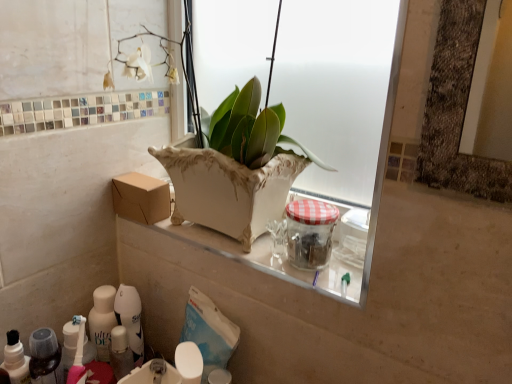
What do you see at coordinates (310, 233) in the screenshot? The width and height of the screenshot is (512, 384). I see `clear glass jar with red checkered lid at center` at bounding box center [310, 233].

What do you see at coordinates (170, 368) in the screenshot? The height and width of the screenshot is (384, 512). I see `white glossy sink at lower center` at bounding box center [170, 368].

Where is `white glossy toothpaste tube at lower left`? white glossy toothpaste tube at lower left is located at coordinates (16, 359).

Is white glossy sink at lower center shorter than white glossy toothpaste tube at lower left?

Indeed, white glossy sink at lower center has a lesser height compared to white glossy toothpaste tube at lower left.

From the image's perspective, is white glossy sink at lower center above or below white glossy toothpaste tube at lower left?

white glossy sink at lower center is situated lower than white glossy toothpaste tube at lower left in the image.

Does white glossy sink at lower center contain white glossy toothpaste tube at lower left?

No, white glossy toothpaste tube at lower left is not a part of white glossy sink at lower center.

In terms of width, does white glossy sink at lower center look wider or thinner when compared to white glossy toothpaste tube at lower left?

Considering their sizes, white glossy sink at lower center looks broader than white glossy toothpaste tube at lower left.

Can you see white glossy toothpaste tube at lower left touching brown cardboard box at center?

white glossy toothpaste tube at lower left is not next to brown cardboard box at center, and they're not touching.

Considering the sizes of objects white glossy toothpaste tube at lower left and brown cardboard box at center in the image provided, who is taller, white glossy toothpaste tube at lower left or brown cardboard box at center?

white glossy toothpaste tube at lower left is taller.

Considering the sizes of objects white glossy toothpaste tube at lower left and brown cardboard box at center in the image provided, who is wider, white glossy toothpaste tube at lower left or brown cardboard box at center?

brown cardboard box at center.

Can you confirm if white glossy sink at lower center is positioned to the left of brown cardboard box at center?

No.

Locate an element on the screen. The height and width of the screenshot is (384, 512). cardboard box on the left of white glossy sink at lower center is located at coordinates (141, 198).

Is white glossy sink at lower center facing away from brown cardboard box at center?

white glossy sink at lower center is not turned away from brown cardboard box at center.

What's the angular difference between white glossy sink at lower center and brown cardboard box at center's facing directions?

The facing directions of white glossy sink at lower center and brown cardboard box at center are 2.61 degrees apart.

Is point (199, 361) farther from camera compared to point (310, 234)?

That is False.

What's the angular difference between white glossy sink at lower center and clear glass jar with red checkered lid at center's facing directions?

There is a 4.91-degree angle between the facing directions of white glossy sink at lower center and clear glass jar with red checkered lid at center.

Is white glossy sink at lower center shorter than clear glass jar with red checkered lid at center?

Yes, white glossy sink at lower center is shorter than clear glass jar with red checkered lid at center.

From a real-world perspective, is white glossy sink at lower center positioned over clear glass jar with red checkered lid at center based on gravity?

No.

Which object is thinner, brown cardboard box at center or clear glass jar with red checkered lid at center?

clear glass jar with red checkered lid at center is thinner.

Looking at this image, would you say brown cardboard box at center is inside or outside clear glass jar with red checkered lid at center?

brown cardboard box at center is located beyond the bounds of clear glass jar with red checkered lid at center.

Is point (115, 208) farther from camera compared to point (301, 237)?

Yes.

From a real-world perspective, which object rests below the other?

brown cardboard box at center is physically lower.

From the picture: Are white ceramic vase at center and white glossy sink at lower center making contact?

No.

Is white ceramic vase at center bigger than white glossy sink at lower center?

Yes, white ceramic vase at center is bigger than white glossy sink at lower center.

How many degrees apart are the facing directions of white ceramic vase at center and white glossy sink at lower center?

The angular difference between white ceramic vase at center and white glossy sink at lower center is 4.86 degrees.

Is white glossy toothpaste tube at lower left facing away from clear glass jar with red checkered lid at center?

white glossy toothpaste tube at lower left does not have its back to clear glass jar with red checkered lid at center.

From a real-world perspective, which object stands above the other?

clear glass jar with red checkered lid at center is physically above.

Is white glossy toothpaste tube at lower left outside of clear glass jar with red checkered lid at center?

white glossy toothpaste tube at lower left lies outside clear glass jar with red checkered lid at center's area.

Is the surface of white glossy toothpaste tube at lower left in direct contact with clear glass jar with red checkered lid at center?

No.

Identify the location of toiletry behind the white glossy sink at lower center. This screenshot has width=512, height=384. tap(16, 359).

The width and height of the screenshot is (512, 384). Find the location of `toiletry lying on the left of brown cardboard box at center`. toiletry lying on the left of brown cardboard box at center is located at coordinates (16, 359).

When comparing their distances from white glossy sink at lower center, does brown cardboard box at center or white glossy toothpaste tube at lower left seem closer?

Based on the image, white glossy toothpaste tube at lower left appears to be nearer to white glossy sink at lower center.

Considering their positions, is white ceramic vase at center positioned further to clear glass jar with red checkered lid at center than white glossy toothpaste tube at lower left?

white glossy toothpaste tube at lower left is further to clear glass jar with red checkered lid at center.

When comparing their distances from white glossy toothpaste tube at lower left, does white glossy sink at lower center or brown cardboard box at center seem closer?

white glossy sink at lower center.

Based on the photo, which object lies nearer to the anchor point white glossy toothpaste tube at lower left, white ceramic vase at center or clear glass jar with red checkered lid at center?

clear glass jar with red checkered lid at center lies closer to white glossy toothpaste tube at lower left than the other object.

From the image, which object appears to be farther from clear glass jar with red checkered lid at center, white glossy sink at lower center or white ceramic vase at center?

Based on the image, white glossy sink at lower center appears to be further to clear glass jar with red checkered lid at center.

Considering their positions, is white ceramic vase at center positioned further to white glossy toothpaste tube at lower left than white glossy sink at lower center?

white ceramic vase at center is further to white glossy toothpaste tube at lower left.

From the image, which object appears to be nearer to white ceramic vase at center, clear glass jar with red checkered lid at center or brown cardboard box at center?

clear glass jar with red checkered lid at center is closer to white ceramic vase at center.

Which object lies further to the anchor point white glossy sink at lower center, white glossy toothpaste tube at lower left or brown cardboard box at center?

Among the two, brown cardboard box at center is located further to white glossy sink at lower center.

Where is `glass jar that lies between brown cardboard box at center and white glossy sink at lower center from top to bottom`? The image size is (512, 384). glass jar that lies between brown cardboard box at center and white glossy sink at lower center from top to bottom is located at coordinates (310, 233).

Where is `toiletry between white ceramic vase at center and white glossy sink at lower center from top to bottom`? This screenshot has height=384, width=512. toiletry between white ceramic vase at center and white glossy sink at lower center from top to bottom is located at coordinates (16, 359).

Where is `sink between white glossy toothpaste tube at lower left and clear glass jar with red checkered lid at center`? sink between white glossy toothpaste tube at lower left and clear glass jar with red checkered lid at center is located at coordinates (170, 368).

The width and height of the screenshot is (512, 384). I want to click on window between brown cardboard box at center and clear glass jar with red checkered lid at center, so click(288, 130).